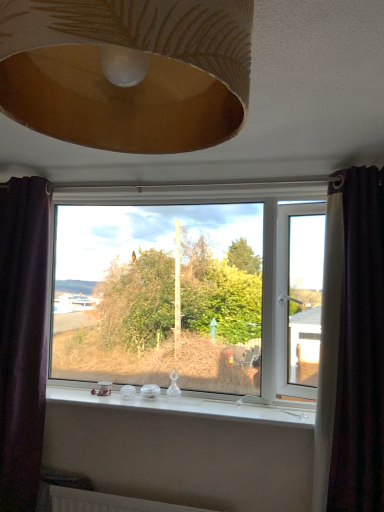
At what (x,y) coordinates should I click in order to perform the action: click on transparent glass window at center. Please return your answer as a coordinate pair (x, y). This screenshot has width=384, height=512. Looking at the image, I should click on (190, 292).

At what (x,y) coordinates should I click in order to perform the action: click on purple fabric curtain at left, marked as the 2th curtain in a right-to-left arrangement. Please return your answer as a coordinate pair (x, y). This screenshot has height=512, width=384. Looking at the image, I should click on (22, 338).

This screenshot has width=384, height=512. I want to click on gold textured lampshade at upper center, so click(127, 71).

This screenshot has height=512, width=384. Identify the location of dark purple velvet curtain at right, which is counted as the first curtain, starting from the right. (360, 350).

Locate an element on the screen. transparent glass window at center is located at coordinates (190, 292).

Considering the positions of objects purple fabric curtain at left, positioned as the 1th curtain in left-to-right order, and white glossy window sill at center in the image provided, who is more to the left, purple fabric curtain at left, positioned as the 1th curtain in left-to-right order, or white glossy window sill at center?

From the viewer's perspective, purple fabric curtain at left, positioned as the 1th curtain in left-to-right order, appears more on the left side.

Is point (3, 264) more distant than point (89, 395)?

That is False.

Find the location of `window sill on the right of purple fabric curtain at left, positioned as the 1th curtain in left-to-right order`. window sill on the right of purple fabric curtain at left, positioned as the 1th curtain in left-to-right order is located at coordinates (194, 405).

Who is bigger, purple fabric curtain at left, positioned as the 1th curtain in left-to-right order, or white glossy window sill at center?

With larger size is purple fabric curtain at left, positioned as the 1th curtain in left-to-right order.

Would you say white glossy window sill at center is a long distance from dark purple velvet curtain at right, arranged as the second curtain when viewed from the left?

No, white glossy window sill at center is not far away from dark purple velvet curtain at right, arranged as the second curtain when viewed from the left.

Where is `window sill that is below the dark purple velvet curtain at right, arranged as the second curtain when viewed from the left (from the image's perspective)`? This screenshot has height=512, width=384. window sill that is below the dark purple velvet curtain at right, arranged as the second curtain when viewed from the left (from the image's perspective) is located at coordinates (194, 405).

What's the angular difference between white glossy window sill at center and dark purple velvet curtain at right, arranged as the second curtain when viewed from the left,'s facing directions?

0.457 degrees.

Considering the relative positions of white glossy window sill at center and dark purple velvet curtain at right, arranged as the second curtain when viewed from the left, in the image provided, is white glossy window sill at center to the left of dark purple velvet curtain at right, arranged as the second curtain when viewed from the left, from the viewer's perspective?

Yes, white glossy window sill at center is to the left of dark purple velvet curtain at right, arranged as the second curtain when viewed from the left.

Is transparent glass window at center facing away from gold textured lampshade at upper center?

That's not correct — transparent glass window at center is not looking away from gold textured lampshade at upper center.

Is transparent glass window at center to the left of gold textured lampshade at upper center from the viewer's perspective?

Yes.

In terms of width, does transparent glass window at center look wider or thinner when compared to gold textured lampshade at upper center?

In the image, transparent glass window at center appears to be more narrow than gold textured lampshade at upper center.

Is white glossy window sill at center thinner than gold textured lampshade at upper center?

Yes.

From a real-world perspective, is white glossy window sill at center physically above gold textured lampshade at upper center?

No.

You are a GUI agent. You are given a task and a screenshot of the screen. Output one action in this format:
    pyautogui.click(x=<x>, y=<y>)
    Task: Click on the window sill on the right of gold textured lampshade at upper center
    The width and height of the screenshot is (384, 512).
    Given the screenshot: What is the action you would take?
    pyautogui.click(x=194, y=405)

Which object is closer to the camera taking this photo, white glossy window sill at center or gold textured lampshade at upper center?

gold textured lampshade at upper center is closer to the camera.

Is dark purple velvet curtain at right, which is counted as the first curtain, starting from the right, aimed at purple fabric curtain at left, positioned as the 1th curtain in left-to-right order?

No, dark purple velvet curtain at right, which is counted as the first curtain, starting from the right, is not facing towards purple fabric curtain at left, positioned as the 1th curtain in left-to-right order.

Where is `curtain lying below the dark purple velvet curtain at right, arranged as the second curtain when viewed from the left (from the image's perspective)`? curtain lying below the dark purple velvet curtain at right, arranged as the second curtain when viewed from the left (from the image's perspective) is located at coordinates (22, 338).

Considering the relative positions of dark purple velvet curtain at right, arranged as the second curtain when viewed from the left, and purple fabric curtain at left, positioned as the 1th curtain in left-to-right order, in the image provided, is dark purple velvet curtain at right, arranged as the second curtain when viewed from the left, to the right of purple fabric curtain at left, positioned as the 1th curtain in left-to-right order, from the viewer's perspective?

Yes.

Is dark purple velvet curtain at right, arranged as the second curtain when viewed from the left, positioned far away from purple fabric curtain at left, positioned as the 1th curtain in left-to-right order?

Indeed, dark purple velvet curtain at right, arranged as the second curtain when viewed from the left, is not near purple fabric curtain at left, positioned as the 1th curtain in left-to-right order.

Consider the image. From the image's perspective, which one is positioned higher, gold textured lampshade at upper center or dark purple velvet curtain at right, which is counted as the first curtain, starting from the right?

gold textured lampshade at upper center is shown above in the image.

Is gold textured lampshade at upper center placed right next to dark purple velvet curtain at right, arranged as the second curtain when viewed from the left?

They are not placed beside each other.

Is gold textured lampshade at upper center shorter than dark purple velvet curtain at right, arranged as the second curtain when viewed from the left?

Indeed, gold textured lampshade at upper center has a lesser height compared to dark purple velvet curtain at right, arranged as the second curtain when viewed from the left.

Considering the relative sizes of gold textured lampshade at upper center and dark purple velvet curtain at right, which is counted as the first curtain, starting from the right, in the image provided, is gold textured lampshade at upper center wider than dark purple velvet curtain at right, which is counted as the first curtain, starting from the right,?

In fact, gold textured lampshade at upper center might be narrower than dark purple velvet curtain at right, which is counted as the first curtain, starting from the right.

Considering their positions, is purple fabric curtain at left, marked as the 2th curtain in a right-to-left arrangement, located in front of or behind gold textured lampshade at upper center?

Visually, purple fabric curtain at left, marked as the 2th curtain in a right-to-left arrangement, is located behind gold textured lampshade at upper center.

From the image's perspective, which object appears higher, purple fabric curtain at left, positioned as the 1th curtain in left-to-right order, or gold textured lampshade at upper center?

gold textured lampshade at upper center is shown above in the image.

Is gold textured lampshade at upper center at the back of purple fabric curtain at left, positioned as the 1th curtain in left-to-right order?

purple fabric curtain at left, positioned as the 1th curtain in left-to-right order, does not have its back to gold textured lampshade at upper center.

Are purple fabric curtain at left, marked as the 2th curtain in a right-to-left arrangement, and gold textured lampshade at upper center far apart?

Yes, purple fabric curtain at left, marked as the 2th curtain in a right-to-left arrangement, and gold textured lampshade at upper center are quite far apart.

Find the location of `window sill in front of the purple fabric curtain at left, positioned as the 1th curtain in left-to-right order`. window sill in front of the purple fabric curtain at left, positioned as the 1th curtain in left-to-right order is located at coordinates (194, 405).

You are a GUI agent. You are given a task and a screenshot of the screen. Output one action in this format:
    pyautogui.click(x=<x>, y=<y>)
    Task: Click on the window sill behind the dark purple velvet curtain at right, arranged as the second curtain when viewed from the left
    Image resolution: width=384 pixels, height=512 pixels.
    Given the screenshot: What is the action you would take?
    pyautogui.click(x=194, y=405)

Estimate the real-world distances between objects in this image. Which object is closer to transparent glass window at center, white glossy window sill at center or dark purple velvet curtain at right, arranged as the second curtain when viewed from the left?

white glossy window sill at center is positioned closer to the anchor transparent glass window at center.

When comparing their distances from transparent glass window at center, does purple fabric curtain at left, marked as the 2th curtain in a right-to-left arrangement, or gold textured lampshade at upper center seem further?

gold textured lampshade at upper center is positioned further to the anchor transparent glass window at center.

Looking at the image, which one is located closer to gold textured lampshade at upper center, purple fabric curtain at left, positioned as the 1th curtain in left-to-right order, or dark purple velvet curtain at right, which is counted as the first curtain, starting from the right?

Among the two, dark purple velvet curtain at right, which is counted as the first curtain, starting from the right, is located nearer to gold textured lampshade at upper center.

When comparing their distances from gold textured lampshade at upper center, does transparent glass window at center or purple fabric curtain at left, positioned as the 1th curtain in left-to-right order, seem further?

The object further to gold textured lampshade at upper center is transparent glass window at center.

From the image, which object appears to be nearer to purple fabric curtain at left, positioned as the 1th curtain in left-to-right order, transparent glass window at center or gold textured lampshade at upper center?

transparent glass window at center is closer to purple fabric curtain at left, positioned as the 1th curtain in left-to-right order.

Which object lies further to the anchor point dark purple velvet curtain at right, which is counted as the first curtain, starting from the right, white glossy window sill at center or gold textured lampshade at upper center?

Among the two, gold textured lampshade at upper center is located further to dark purple velvet curtain at right, which is counted as the first curtain, starting from the right.

Based on their spatial positions, is purple fabric curtain at left, positioned as the 1th curtain in left-to-right order, or dark purple velvet curtain at right, which is counted as the first curtain, starting from the right, further from white glossy window sill at center?

purple fabric curtain at left, positioned as the 1th curtain in left-to-right order, is positioned further to the anchor white glossy window sill at center.

Based on their spatial positions, is transparent glass window at center or dark purple velvet curtain at right, arranged as the second curtain when viewed from the left, further from gold textured lampshade at upper center?

Among the two, transparent glass window at center is located further to gold textured lampshade at upper center.

Where is `window sill situated between purple fabric curtain at left, positioned as the 1th curtain in left-to-right order, and dark purple velvet curtain at right, which is counted as the first curtain, starting from the right, from left to right`? window sill situated between purple fabric curtain at left, positioned as the 1th curtain in left-to-right order, and dark purple velvet curtain at right, which is counted as the first curtain, starting from the right, from left to right is located at coordinates (194, 405).

The image size is (384, 512). What are the coordinates of `curtain between gold textured lampshade at upper center and purple fabric curtain at left, positioned as the 1th curtain in left-to-right order, from front to back` in the screenshot? It's located at (360, 350).

Identify the location of window between purple fabric curtain at left, marked as the 2th curtain in a right-to-left arrangement, and white glossy window sill at center from left to right. The height and width of the screenshot is (512, 384). (190, 292).

Where is `window sill between gold textured lampshade at upper center and transparent glass window at center along the z-axis`? This screenshot has width=384, height=512. window sill between gold textured lampshade at upper center and transparent glass window at center along the z-axis is located at coordinates (194, 405).